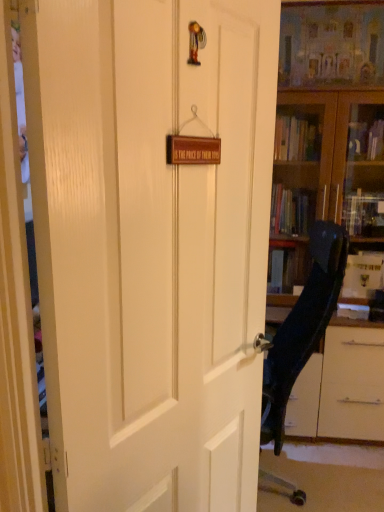
Question: From a real-world perspective, is wooden bookcase at right positioned above or below black plastic chair at right?

Choices:
 (A) below
 (B) above

Answer: (B)

Question: Considering the positions of wooden bookcase at right and black plastic chair at right in the image, is wooden bookcase at right wider or thinner than black plastic chair at right?

Choices:
 (A) thin
 (B) wide

Answer: (B)

Question: Which is nearer to the wooden book at center?

Choices:
 (A) wooden bookcase at right
 (B) white matte door at center
 (C) black plastic chair at right

Answer: (C)

Question: Which object is positioned closest to the white matte door at center?

Choices:
 (A) black plastic chair at right
 (B) wooden bookcase at right
 (C) wooden book at center

Answer: (A)